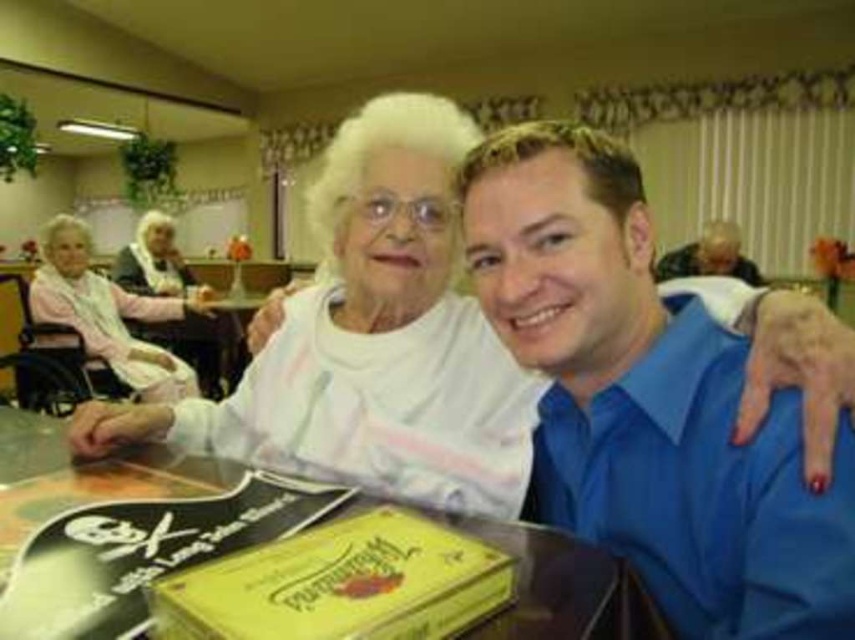
Between white matte/soft fabric at center and pink fabric at left, which one appears on the right side from the viewer's perspective?

white matte/soft fabric at center is more to the right.

Who is higher up, white matte/soft fabric at center or pink fabric at left?

pink fabric at left is higher up.

What do you see at coordinates (372, 339) in the screenshot?
I see `white matte/soft fabric at center` at bounding box center [372, 339].

This screenshot has height=640, width=855. I want to click on white matte/soft fabric at center, so pos(372,339).

The height and width of the screenshot is (640, 855). In order to click on yellow matte book at lower center in this screenshot , I will do 340,584.

Can you confirm if yellow matte book at lower center is positioned to the left of pink fabric at left?

In fact, yellow matte book at lower center is to the right of pink fabric at left.

This screenshot has width=855, height=640. Describe the element at coordinates (340, 584) in the screenshot. I see `yellow matte book at lower center` at that location.

This screenshot has height=640, width=855. What are the coordinates of `yellow matte book at lower center` in the screenshot? It's located at (340, 584).

Does point (10, 474) lie in front of point (175, 307)?

Yes, it is in front of point (175, 307).

Looking at this image, who is lower down, yellow paper at center or pink fabric at left?

yellow paper at center

You are a GUI agent. You are given a task and a screenshot of the screen. Output one action in this format:
    pyautogui.click(x=<x>, y=<y>)
    Task: Click on the yellow paper at center
    
    Given the screenshot: What is the action you would take?
    pyautogui.click(x=552, y=586)